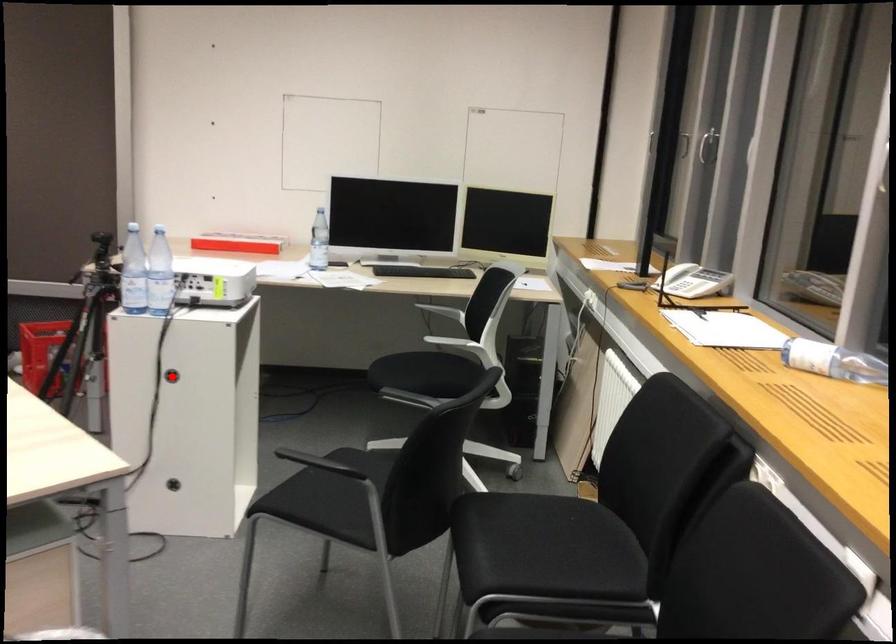
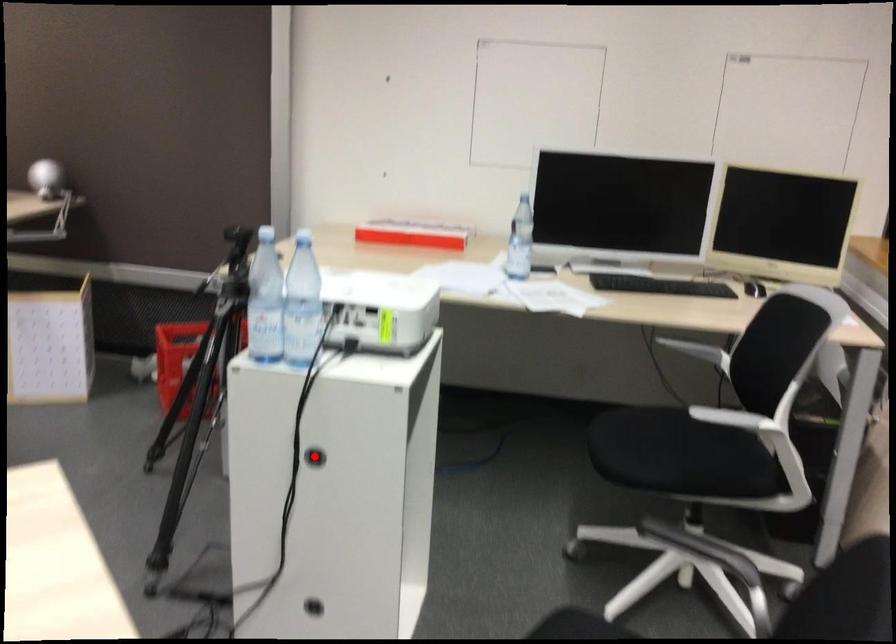
I am providing you with two images of the same scene from different viewpoints. A red point is marked on the first image and another point is marked on the second image. Are the points marked in image1 and image2 representing the same 3D position?

Yes